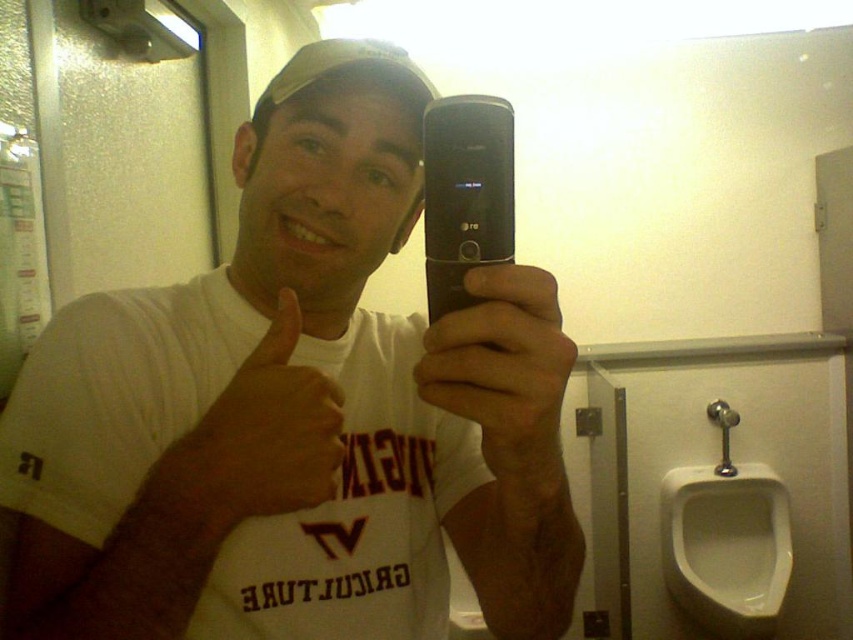
Question: Does white glossy urinal at lower right have a larger size compared to black plastic phone at center?

Choices:
 (A) yes
 (B) no

Answer: (A)

Question: Which object appears farthest from the camera in this image?

Choices:
 (A) matte black phone at center
 (B) white matte t-shirt at center

Answer: (B)

Question: Can you confirm if white matte t-shirt at center is positioned to the left of white glossy urinal at lower right?

Choices:
 (A) yes
 (B) no

Answer: (A)

Question: Which object is positioned farthest from the black plastic phone at center?

Choices:
 (A) skinny white hand at upper center
 (B) matte black phone at center
 (C) white matte t-shirt at center

Answer: (C)

Question: Does matte black phone at center appear over black plastic phone at center?

Choices:
 (A) yes
 (B) no

Answer: (B)

Question: Which point is closer to the camera taking this photo?

Choices:
 (A) (685, 609)
 (B) (482, 124)
 (C) (239, 515)
 (D) (363, 524)

Answer: (B)